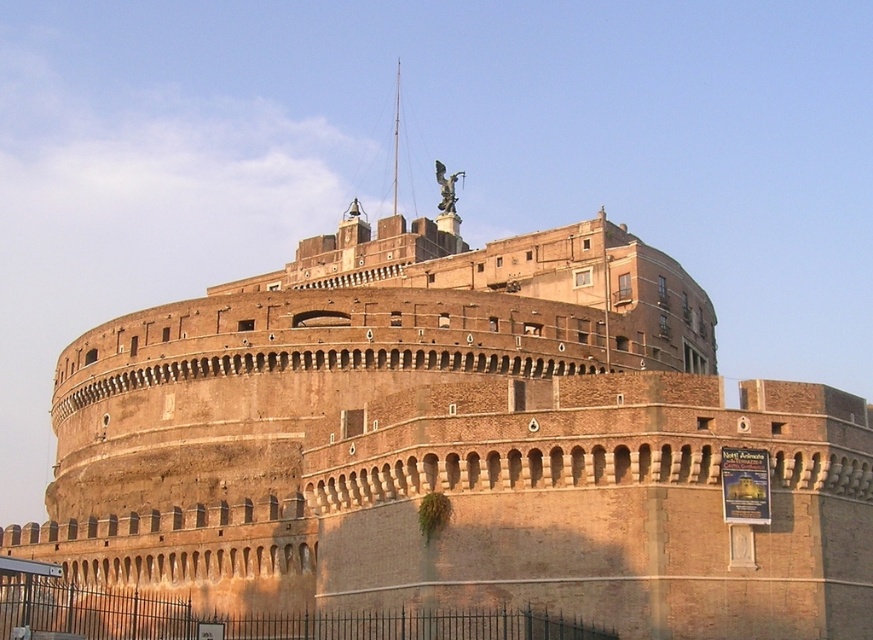
You are a tour guide explaining the castle to visitors. You mention both the black wrought iron fence at lower center and the bronze statue at upper center. Which of these two objects is bigger in size?

The black wrought iron fence at lower center is larger in size than the bronze statue at upper center.

You are standing at the base of the fortress and want to take a photo of the bronze statue at upper center without the black wrought iron fence at lower center appearing in the frame. Which direction should you move to ensure the fence is out of the shot?

Move to the right side of the fortress so that the black wrought iron fence at lower center, which is to the left of the bronze statue at upper center, is no longer blocking the view of the statue.